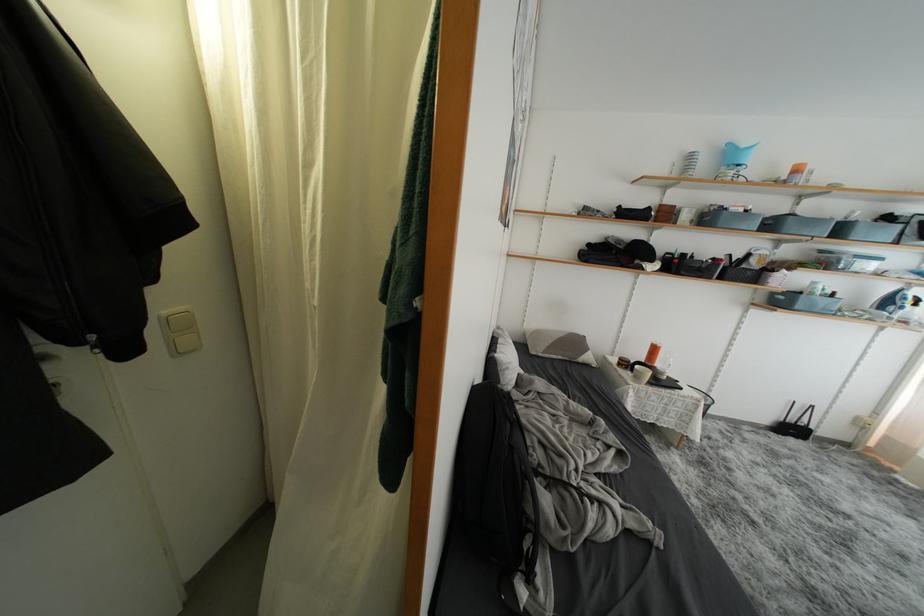
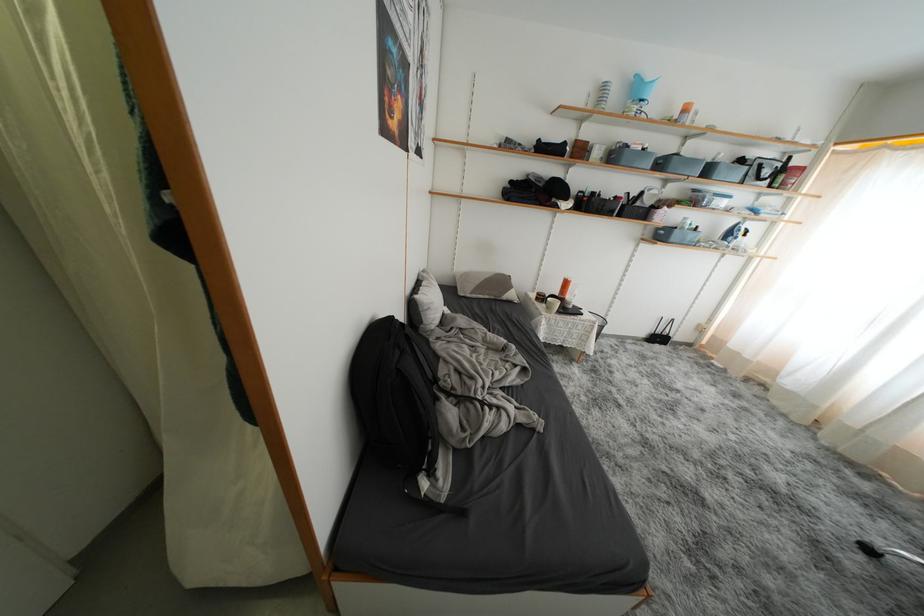
Where in the second image is the point corresponding to (777,229) from the first image?

(667, 168)